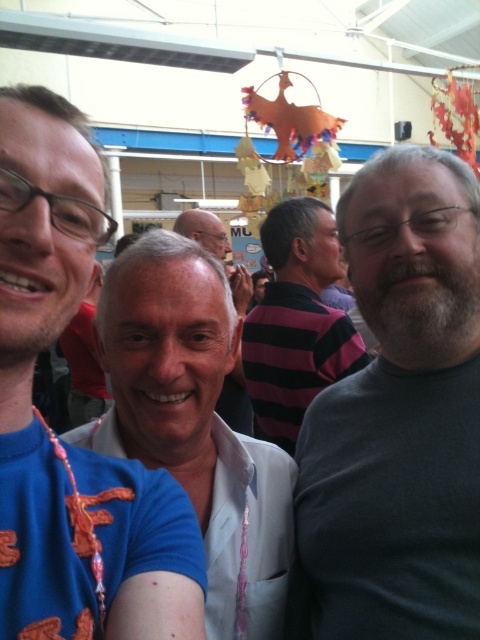
You are organizing a photo shoot and need to adjust the spacing between the blue fabric shirt at left and the white glossy shirt at center. The photographer requires a minimum of 40 centimeters between subjects for optimal lighting. Can the current spacing accommodate this requirement?

The distance between the blue fabric shirt at left and the white glossy shirt at center is 42.15 centimeters, which exceeds the required 40 centimeters. Therefore, the current spacing can accommodate the photographer s requirement.

You are standing in the large hall and want to move from the point marked as point (59, 284) to the point marked as point (166, 412). Which direction should you move to reach your destination?

To move from point (59, 284) to point (166, 412), you should move backward since point (59, 284) is in front of point (166, 412).

You are standing in the large hall and see the striped fabric shirt at center. Can you tell me what is located exactly at the point with coordinates (297,321)?

The striped fabric shirt at center is located exactly at the point with coordinates (297,321).